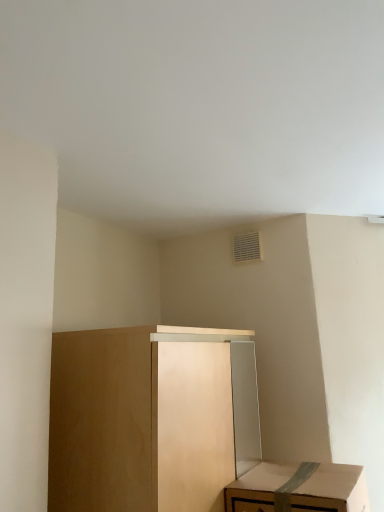
At what (x,y) coordinates should I click in order to perform the action: click on matte wood cabinet at lower left. Please return your answer as a coordinate pair (x, y). Looking at the image, I should click on (141, 419).

What do you see at coordinates (141, 419) in the screenshot? The width and height of the screenshot is (384, 512). I see `matte wood cabinet at lower left` at bounding box center [141, 419].

What is the approximate height of cardboard box at lower right?

9.16 inches.

Describe the element at coordinates (333, 490) in the screenshot. The width and height of the screenshot is (384, 512). I see `cardboard box at lower right` at that location.

At what (x,y) coordinates should I click in order to perform the action: click on cardboard box at lower right. Please return your answer as a coordinate pair (x, y). This screenshot has width=384, height=512. Looking at the image, I should click on (333, 490).

The height and width of the screenshot is (512, 384). I want to click on matte wood cabinet at lower left, so click(141, 419).

Considering the relative positions of matte wood cabinet at lower left and cardboard box at lower right in the image provided, is matte wood cabinet at lower left to the right of cardboard box at lower right from the viewer's perspective?

No, matte wood cabinet at lower left is not to the right of cardboard box at lower right.

Relative to cardboard box at lower right, is matte wood cabinet at lower left in front or behind?

matte wood cabinet at lower left is in front of cardboard box at lower right.

Does point (74, 399) lie in front of point (331, 469)?

Yes, it is.

From the image's perspective, which object appears higher, matte wood cabinet at lower left or cardboard box at lower right?

matte wood cabinet at lower left.

From a real-world perspective, does matte wood cabinet at lower left sit lower than cardboard box at lower right?

No, from a real-world perspective, matte wood cabinet at lower left is not under cardboard box at lower right.

Can you confirm if matte wood cabinet at lower left is thinner than cardboard box at lower right?

No, matte wood cabinet at lower left is not thinner than cardboard box at lower right.

Which of these two, matte wood cabinet at lower left or cardboard box at lower right, stands taller?

With more height is matte wood cabinet at lower left.

Between matte wood cabinet at lower left and cardboard box at lower right, which one has larger size?

matte wood cabinet at lower left is bigger.

Is matte wood cabinet at lower left completely or partially outside of cardboard box at lower right?

Yes, matte wood cabinet at lower left is not within cardboard box at lower right.

Is matte wood cabinet at lower left next to cardboard box at lower right and touching it?

There is a gap between matte wood cabinet at lower left and cardboard box at lower right.

Is matte wood cabinet at lower left positioned with its back to cardboard box at lower right?

→ matte wood cabinet at lower left is not turned away from cardboard box at lower right.

Find the location of a particular element. The width and height of the screenshot is (384, 512). cabinetry in front of the cardboard box at lower right is located at coordinates (141, 419).

Which is more to the left, cardboard box at lower right or matte wood cabinet at lower left?

matte wood cabinet at lower left is more to the left.

Is cardboard box at lower right closer to the viewer compared to matte wood cabinet at lower left?

No, cardboard box at lower right is further to the viewer.

Which is farther from the camera, [274,479] or [102,337]?

→ Positioned behind is point [274,479].

From the image's perspective, is cardboard box at lower right on matte wood cabinet at lower left?

Actually, cardboard box at lower right appears below matte wood cabinet at lower left in the image.

From a real-world perspective, which is physically above, cardboard box at lower right or matte wood cabinet at lower left?

In real-world perspective, matte wood cabinet at lower left is above.

Can you confirm if cardboard box at lower right is wider than matte wood cabinet at lower left?

No, cardboard box at lower right is not wider than matte wood cabinet at lower left.

From their relative heights in the image, would you say cardboard box at lower right is taller or shorter than matte wood cabinet at lower left?

Clearly, cardboard box at lower right is shorter compared to matte wood cabinet at lower left.

Is cardboard box at lower right bigger or smaller than matte wood cabinet at lower left?

cardboard box at lower right is smaller than matte wood cabinet at lower left.

Is cardboard box at lower right positioned beyond the bounds of matte wood cabinet at lower left?

Indeed, cardboard box at lower right is completely outside matte wood cabinet at lower left.

Is cardboard box at lower right in contact with matte wood cabinet at lower left?

cardboard box at lower right and matte wood cabinet at lower left are not in contact.

Is cardboard box at lower right facing away from matte wood cabinet at lower left?

Yes, cardboard box at lower right is positioned with its back facing matte wood cabinet at lower left.

How different are the orientations of cardboard box at lower right and matte wood cabinet at lower left in degrees?

The angular difference between cardboard box at lower right and matte wood cabinet at lower left is 2.01 degrees.

Where is `cabinetry that appears above the cardboard box at lower right (from a real-world perspective)`? cabinetry that appears above the cardboard box at lower right (from a real-world perspective) is located at coordinates (141, 419).

Locate an element on the screen. This screenshot has width=384, height=512. table behind the matte wood cabinet at lower left is located at coordinates [333, 490].

I want to click on table located on the right of matte wood cabinet at lower left, so click(x=333, y=490).